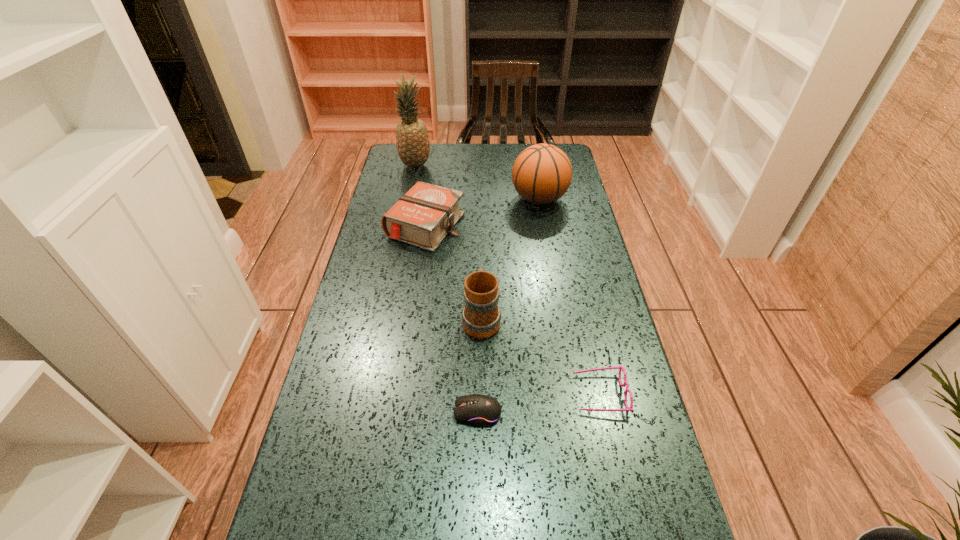
Locate an element on the screen. This screenshot has height=540, width=960. vacant space located 0.390m on the side of the mug with the handle is located at coordinates (481, 218).

At what (x,y) coordinates should I click in order to perform the action: click on free space located on the side of the mug with the handle. Please return your answer as a coordinate pair (x, y). The width and height of the screenshot is (960, 540). Looking at the image, I should click on (481, 286).

Where is `blank space located 0.080m on the side of the mug with the handle`? The image size is (960, 540). blank space located 0.080m on the side of the mug with the handle is located at coordinates (481, 279).

I want to click on free space located 0.370m on the right of the Bible, so click(571, 226).

In order to click on vacant point located 0.160m on the arms of the spectacles in this screenshot , I will do `click(509, 394)`.

Image resolution: width=960 pixels, height=540 pixels. Find the location of `free spot located 0.140m on the arms of the spectacles`. free spot located 0.140m on the arms of the spectacles is located at coordinates (517, 394).

Identify the location of free location located 0.370m on the arms of the spectacles. (421, 394).

The height and width of the screenshot is (540, 960). Identify the location of blank area located 0.080m on the front of the computer mouse. (477, 462).

Identify the location of object present at the far edge. The image size is (960, 540). (412, 139).

Locate an element on the screen. pineapple that is positioned at the left edge is located at coordinates (412, 139).